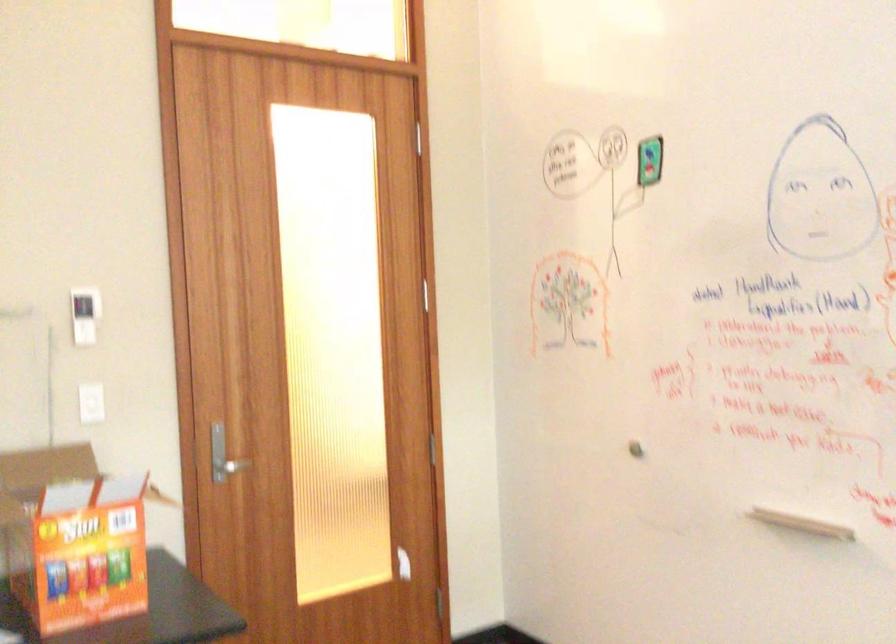
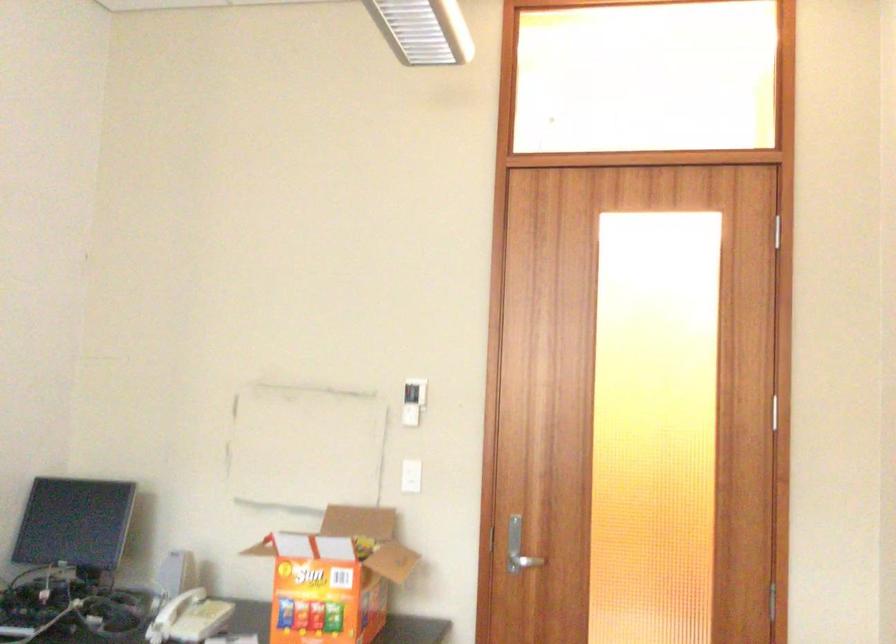
In the second image, find the point that corresponds to point (83, 314) in the first image.

(412, 401)